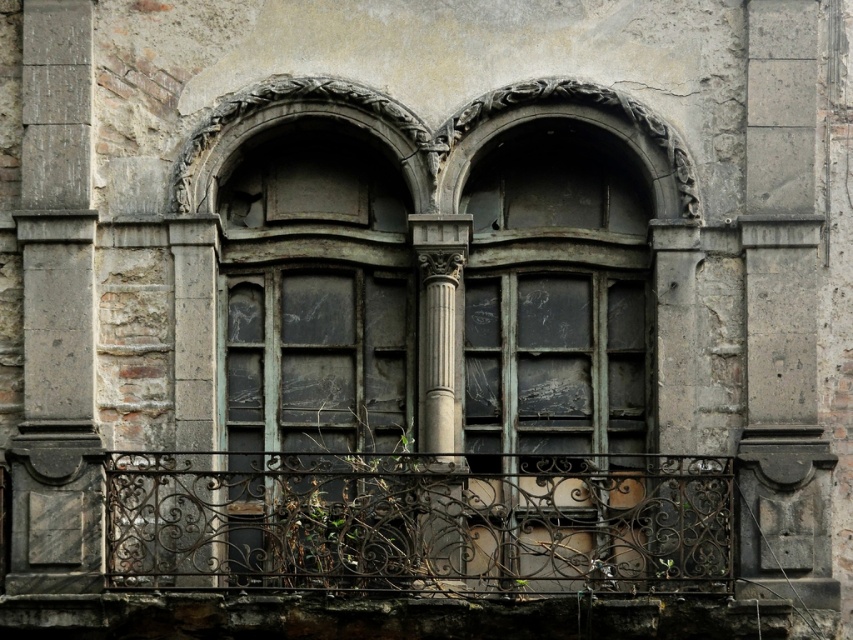
You are an architect inspecting the old building. You need to determine if the rusty wrought iron railing at center can be replaced without affecting the gray stone column at left. Based on their widths, is this possible?

The rusty wrought iron railing at center might be wider than gray stone column at left, so there is a possibility that replacing the railing could affect the column if their widths overlap. Further measurements are needed to confirm.